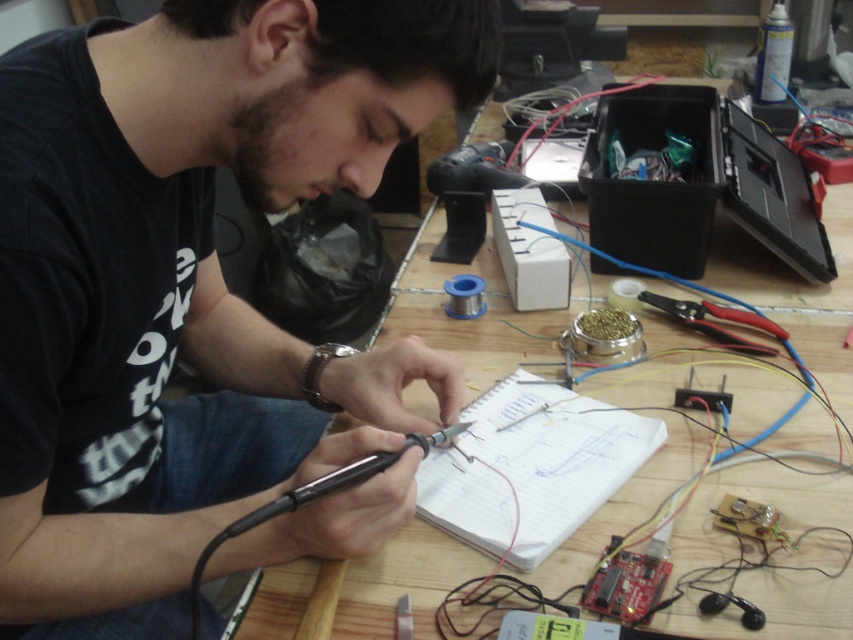
In the scene shown: You are an electronics hobbyist trying to organize your workspace. You need to place a new tool on the table. The black matte soldering iron at center is currently in use. Where should you place the new tool so it doesn not interfere with the soldering iron and the white paper at center?

The black matte soldering iron at center is located above the white paper at center. To avoid interference, place the new tool either to the side of the soldering iron or below the white paper at center where there is more space.

You are a person who needs to place a 5 inch long tool on the wooden table at center so that it doesn not overlap with the white paper at center. Is this possible?

The distance between the wooden table at center and the white paper at center is 5.18 inches. Since the tool is 5 inches long, it can be placed on the table without overlapping the paper as the available space is slightly larger than the tool.

You are a technician who needs to reach the black matte soldering iron at center from your current position. Can you comfortably extend your arm to reach it without moving your chair?

The black matte soldering iron at center is 55.36 centimeters away from the viewer. Since the average human arm length is about 60 centimeters, you can comfortably extend your arm to reach it without moving your chair.